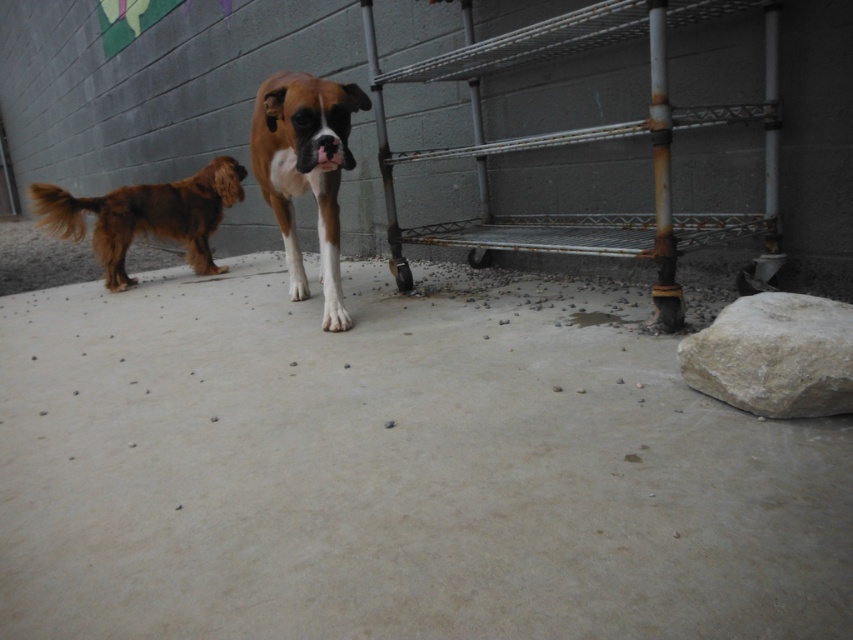
Question: Does white rough rock at right have a larger size compared to shiny brown fur at left?

Choices:
 (A) yes
 (B) no

Answer: (B)

Question: Is the position of rusty metal rack at lower right more distant than that of white rough rock at right?

Choices:
 (A) no
 (B) yes

Answer: (B)

Question: Which point appears closest to the camera in this image?

Choices:
 (A) (283, 193)
 (B) (67, 196)
 (C) (737, 328)
 (D) (473, 109)

Answer: (C)

Question: Which point is farther from the camera taking this photo?

Choices:
 (A) (544, 218)
 (B) (320, 154)
 (C) (126, 204)

Answer: (C)

Question: Can you confirm if rusty metal rack at lower right is positioned above brown matte dog at center?

Choices:
 (A) yes
 (B) no

Answer: (A)

Question: Which point is closer to the camera taking this photo?

Choices:
 (A) (811, 380)
 (B) (315, 177)
 (C) (196, 189)
 (D) (672, 228)

Answer: (A)